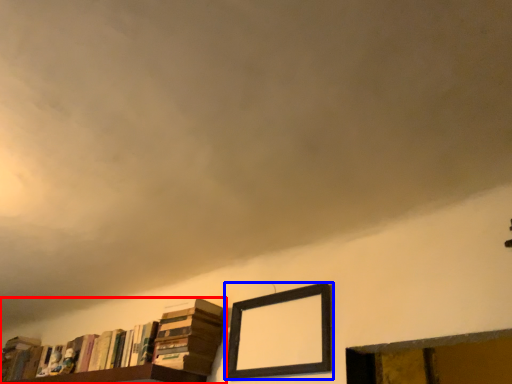
Question: Which point is further to the camera, book (highlighted by a red box) or picture frame (highlighted by a blue box)?

Choices:
 (A) book
 (B) picture frame

Answer: (A)